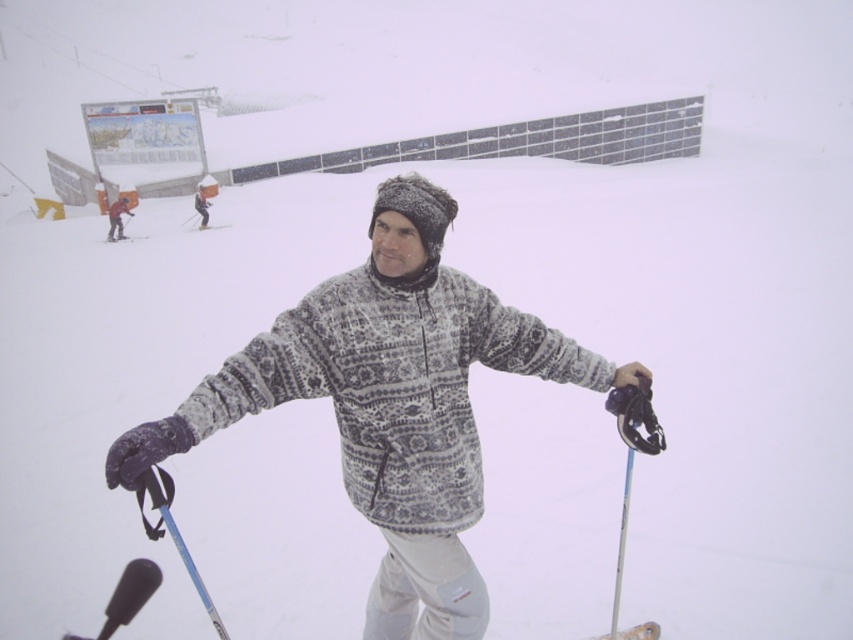
Question: Can you confirm if white snowsuit at upper left is wider than white plastic ski at upper center?

Choices:
 (A) yes
 (B) no

Answer: (B)

Question: Which object is the farthest from the black matte ski at upper left?

Choices:
 (A) blue plastic ski pole at lower left
 (B) white snowsuit at upper left
 (C) patterned fleece jacket at center
 (D) white plastic ski at upper center

Answer: (A)

Question: Which point is farther to the camera?

Choices:
 (A) (164, 522)
 (B) (224, 227)
 (C) (107, 241)

Answer: (B)

Question: Does patterned fleece jacket at center have a lesser width compared to blue plastic ski pole at lower left?

Choices:
 (A) yes
 (B) no

Answer: (B)

Question: Which point appears farthest from the camera in this image?

Choices:
 (A) (143, 237)
 (B) (358, 404)
 (C) (108, 236)

Answer: (C)

Question: Does patterned fleece jacket at center have a greater width compared to orange fabric jacket at upper left?

Choices:
 (A) yes
 (B) no

Answer: (A)